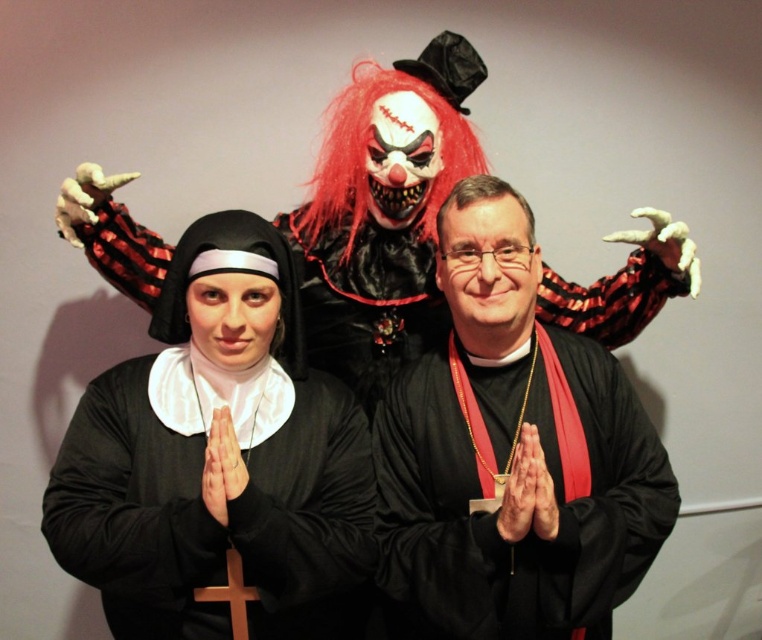
You are organizing a costume party and need to arrange the black matte nun at center and the black matte priest at center on a shelf. If the shelf has limited space, which costume should you place first to ensure both fit?

The black matte nun at center is smaller in size compared to the black matte priest at center, so you should place the black matte priest at center first to accommodate its larger size, then the nun will fit alongside.

You are a costume designer assessing the image. Which object is taller, the black matte nun at center or the red synthetic wig at center?

The black matte nun at center is taller than the red synthetic wig at center according to the description.

You are a costume designer assessing the image. You need to determine if the black matte priest at center can be seen clearly over the red synthetic wig at center. Based on their sizes, what is your assessment?

The black matte priest at center is bigger than the red synthetic wig at center, so the priest costume will likely be more prominent and easily visible compared to the wig.